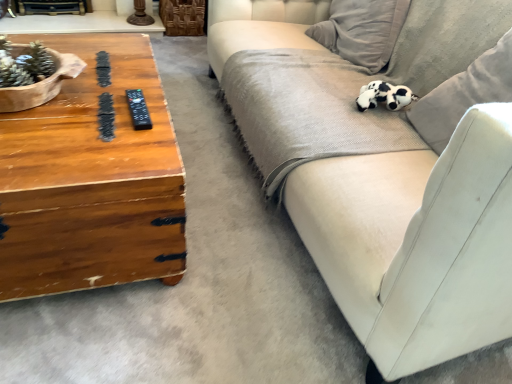
What do you see at coordinates (384, 96) in the screenshot?
I see `black and white plush toy at upper right` at bounding box center [384, 96].

The image size is (512, 384). I want to click on woodenmaterial/texturecoffee table at left, so click(x=91, y=181).

What are the coordinates of `black plastic remote at left` in the screenshot? It's located at (138, 110).

The width and height of the screenshot is (512, 384). Identify the location of coffee table that is on the left side of black and white plush toy at upper right. (91, 181).

Is black and white plush toy at upper right further to camera compared to woodenmaterial/texturecoffee table at left?

Yes.

Is point (375, 86) closer to camera compared to point (39, 150)?

No, it is not.

Are black and white plush toy at upper right and woodenmaterial/texturecoffee table at left far apart?

No, black and white plush toy at upper right is not far from woodenmaterial/texturecoffee table at left.

Who is shorter, woodenmaterial/texturecoffee table at left or velvet beige couch at right?

woodenmaterial/texturecoffee table at left.

Are woodenmaterial/texturecoffee table at left and velvet beige couch at right far apart?

woodenmaterial/texturecoffee table at left is actually quite close to velvet beige couch at right.

Identify the location of coffee table below the velvet beige couch at right (from a real-world perspective). This screenshot has height=384, width=512. (91, 181).

How different are the orientations of woodenmaterial/texturecoffee table at left and velvet beige couch at right in degrees?

The angular difference between woodenmaterial/texturecoffee table at left and velvet beige couch at right is 89 degrees.

From a real-world perspective, is black and white plush toy at upper right positioned above or below black plastic remote at left?

In terms of real-world spatial position, black and white plush toy at upper right is below black plastic remote at left.

Image resolution: width=512 pixels, height=384 pixels. What are the coordinates of `animal located on the right of black plastic remote at left` in the screenshot? It's located at (384, 96).

Is black and white plush toy at upper right beside black plastic remote at left?

black and white plush toy at upper right is not next to black plastic remote at left, and they're not touching.

Looking at this image, is the position of black and white plush toy at upper right less distant than that of black plastic remote at left?

That is False.

Is black and white plush toy at upper right touching velvet beige couch at right?

No, black and white plush toy at upper right is not in contact with velvet beige couch at right.

From a real-world perspective, who is located higher, black and white plush toy at upper right or velvet beige couch at right?

velvet beige couch at right.

Which object is thinner, black and white plush toy at upper right or velvet beige couch at right?

With smaller width is black and white plush toy at upper right.

Does black plastic remote at left have a lesser width compared to woodenmaterial/texturecoffee table at left?

Correct, the width of black plastic remote at left is less than that of woodenmaterial/texturecoffee table at left.

Is black plastic remote at left looking in the opposite direction of woodenmaterial/texturecoffee table at left?

No, black plastic remote at left is not facing the opposite direction of woodenmaterial/texturecoffee table at left.

Looking at the image, does black plastic remote at left seem bigger or smaller compared to woodenmaterial/texturecoffee table at left?

Clearly, black plastic remote at left is smaller in size than woodenmaterial/texturecoffee table at left.

Is black plastic remote at left to the right of woodenmaterial/texturecoffee table at left from the viewer's perspective?

Yes, black plastic remote at left is to the right of woodenmaterial/texturecoffee table at left.

How different are the orientations of black plastic remote at left and velvet beige couch at right in degrees?

93.8 degrees separate the facing orientations of black plastic remote at left and velvet beige couch at right.

Considering the sizes of black plastic remote at left and velvet beige couch at right in the image, is black plastic remote at left wider or thinner than velvet beige couch at right?

Considering their sizes, black plastic remote at left looks slimmer than velvet beige couch at right.

Does black plastic remote at left have a lesser height compared to velvet beige couch at right?

Yes.

Is black plastic remote at left oriented towards velvet beige couch at right?

No.

Does black plastic remote at left touch black and white plush toy at upper right?

black plastic remote at left is not next to black and white plush toy at upper right, and they're not touching.

Is black plastic remote at left shorter than black and white plush toy at upper right?

Indeed, black plastic remote at left has a lesser height compared to black and white plush toy at upper right.

Considering the positions of points (141, 106) and (396, 99), is point (141, 106) closer to camera compared to point (396, 99)?

Yes, it is in front of point (396, 99).

This screenshot has height=384, width=512. I want to click on coffee table that is on the left side of black and white plush toy at upper right, so click(91, 181).

The image size is (512, 384). Find the location of `studio couch behind the woodenmaterial/texturecoffee table at left`. studio couch behind the woodenmaterial/texturecoffee table at left is located at coordinates (381, 172).

Considering their positions, is woodenmaterial/texturecoffee table at left positioned closer to velvet beige couch at right than black plastic remote at left?

woodenmaterial/texturecoffee table at left lies closer to velvet beige couch at right than the other object.

Looking at the image, which one is located closer to black and white plush toy at upper right, black plastic remote at left or velvet beige couch at right?

velvet beige couch at right lies closer to black and white plush toy at upper right than the other object.

When comparing their distances from woodenmaterial/texturecoffee table at left, does black and white plush toy at upper right or black plastic remote at left seem further?

Among the two, black and white plush toy at upper right is located further to woodenmaterial/texturecoffee table at left.

Looking at the image, which one is located further to woodenmaterial/texturecoffee table at left, velvet beige couch at right or black plastic remote at left?

velvet beige couch at right.

Estimate the real-world distances between objects in this image. Which object is closer to black plastic remote at left, black and white plush toy at upper right or velvet beige couch at right?

Based on the image, velvet beige couch at right appears to be nearer to black plastic remote at left.

From the image, which object appears to be farther from velvet beige couch at right, woodenmaterial/texturecoffee table at left or black and white plush toy at upper right?

woodenmaterial/texturecoffee table at left.

Based on their spatial positions, is velvet beige couch at right or black and white plush toy at upper right closer to woodenmaterial/texturecoffee table at left?

velvet beige couch at right is positioned closer to the anchor woodenmaterial/texturecoffee table at left.

Considering their positions, is black plastic remote at left positioned further to woodenmaterial/texturecoffee table at left than velvet beige couch at right?

velvet beige couch at right lies further to woodenmaterial/texturecoffee table at left than the other object.

Where is `animal between woodenmaterial/texturecoffee table at left and velvet beige couch at right in the horizontal direction`? The image size is (512, 384). animal between woodenmaterial/texturecoffee table at left and velvet beige couch at right in the horizontal direction is located at coordinates (384, 96).

This screenshot has height=384, width=512. I want to click on remote located between woodenmaterial/texturecoffee table at left and velvet beige couch at right in the left-right direction, so click(138, 110).

You are a GUI agent. You are given a task and a screenshot of the screen. Output one action in this format:
    pyautogui.click(x=<x>, y=<y>)
    Task: Click on the remote between woodenmaterial/texturecoffee table at left and black and white plush toy at upper right in the horizontal direction
    The height and width of the screenshot is (384, 512).
    Given the screenshot: What is the action you would take?
    pyautogui.click(x=138, y=110)

At what (x,y) coordinates should I click in order to perform the action: click on animal situated between black plastic remote at left and velvet beige couch at right from left to right. Please return your answer as a coordinate pair (x, y). Looking at the image, I should click on (384, 96).